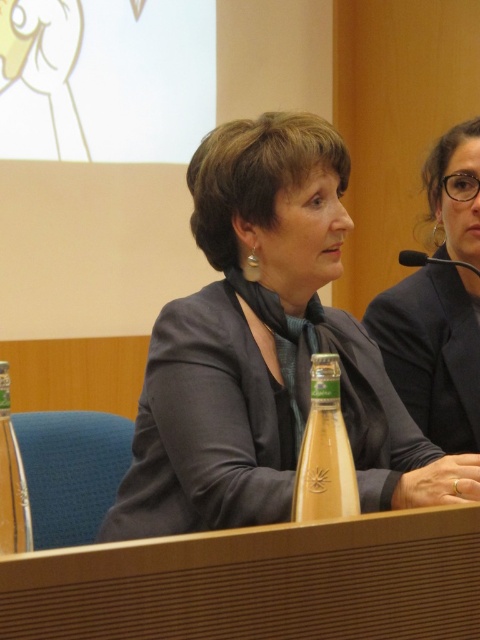
Is clear glass bottle at center smaller than clear glass bottle at left?

Incorrect, clear glass bottle at center is not smaller in size than clear glass bottle at left.

Does clear glass bottle at center have a lesser height compared to clear glass bottle at left?

Yes, clear glass bottle at center is shorter than clear glass bottle at left.

Who is more forward, [312,509] or [17,529]?

Positioned in front is point [17,529].

Where is `clear glass bottle at center`? The image size is (480, 640). clear glass bottle at center is located at coordinates (324, 451).

Is matte gray blazer at center positioned behind wooden at center?

Yes, it is behind wooden at center.

Between point (316, 243) and point (45, 561), which one is positioned behind?

The point (316, 243) is behind.

At what (x,y) coordinates should I click in order to perform the action: click on matte gray blazer at center. Please return your answer as a coordinate pair (x, y). Looking at the image, I should click on (265, 352).

Where is `matte gray blazer at center`? Image resolution: width=480 pixels, height=640 pixels. matte gray blazer at center is located at coordinates (265, 352).

Can you confirm if wooden at center is shorter than clear glass bottle at left?

Correct, wooden at center is not as tall as clear glass bottle at left.

This screenshot has width=480, height=640. What do you see at coordinates (259, 582) in the screenshot?
I see `wooden at center` at bounding box center [259, 582].

At what (x,y) coordinates should I click in order to perform the action: click on wooden at center. Please return your answer as a coordinate pair (x, y). Image resolution: width=480 pixels, height=640 pixels. Looking at the image, I should click on (259, 582).